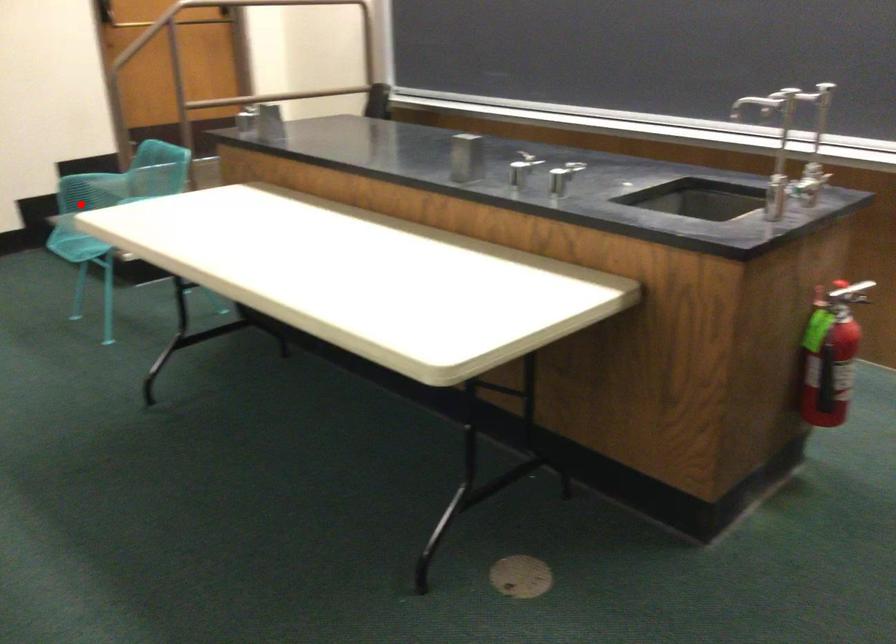
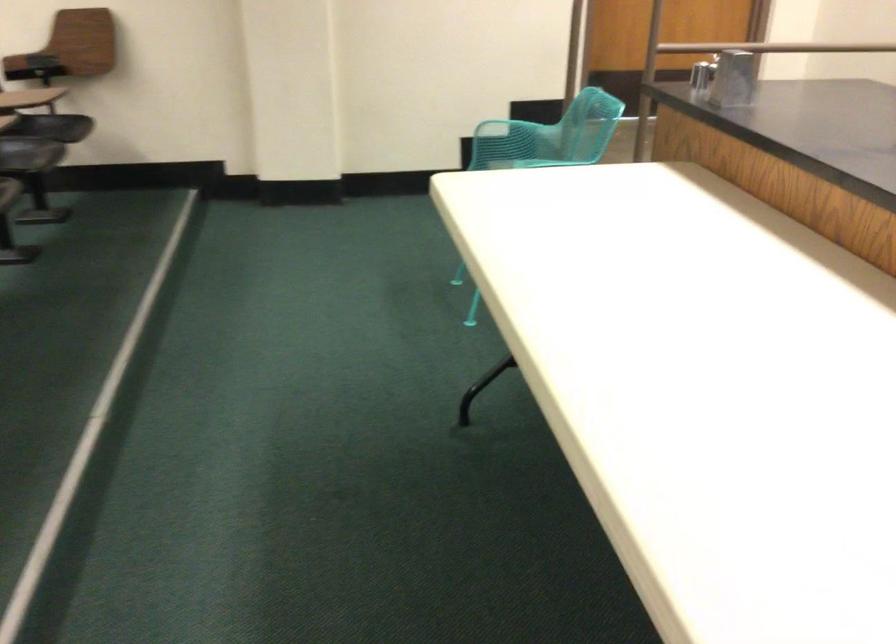
The point at the highlighted location is marked in the first image. Where is the corresponding point in the second image?

(489, 158)